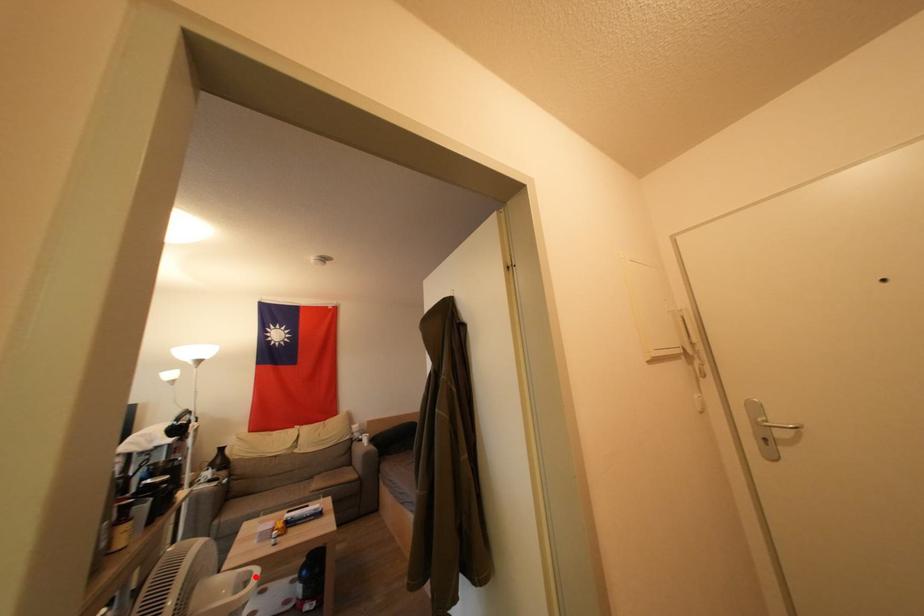
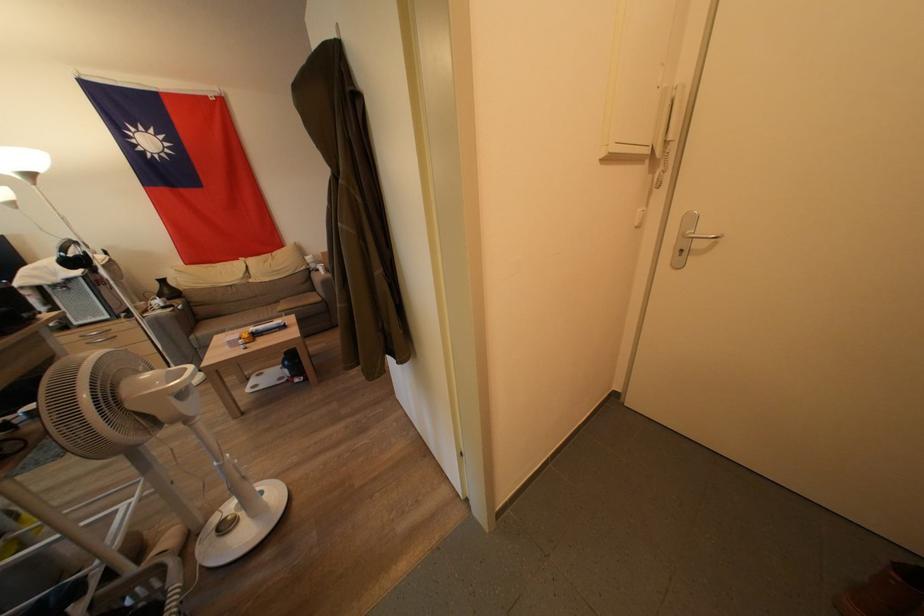
Question: I am providing you with two images of the same scene from different viewpoints. Given a red point in image1, look at the same physical point in image2. Is it:

Choices:
 (A) Closer to the viewpoint
 (B) Farther from the viewpoint

Answer: (A)